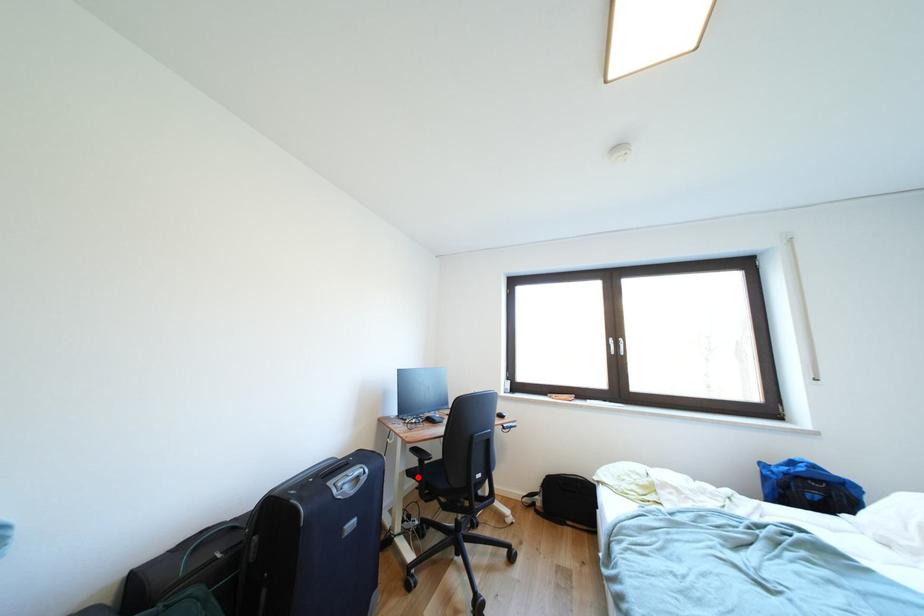
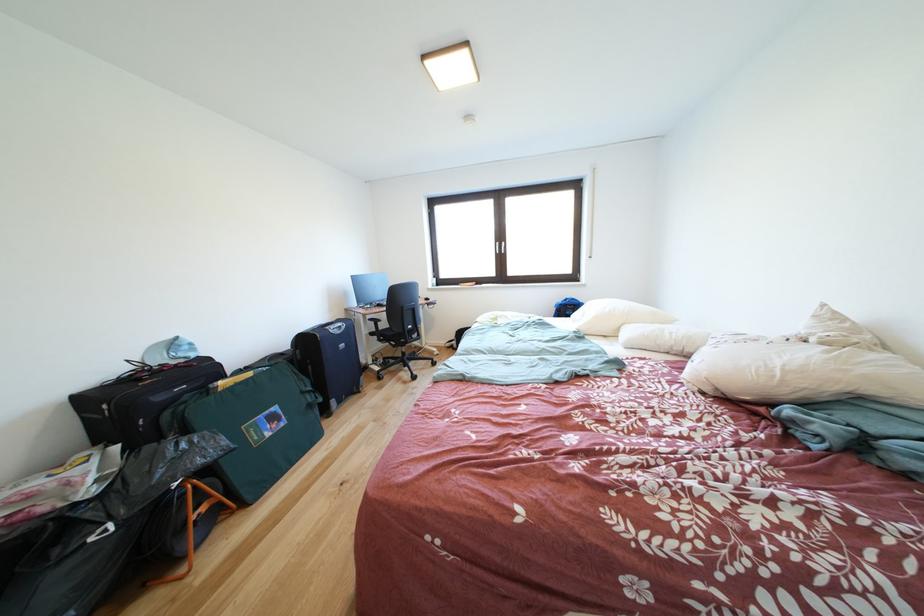
In the second image, find the point that corresponds to the highlighted location in the first image.

(380, 339)